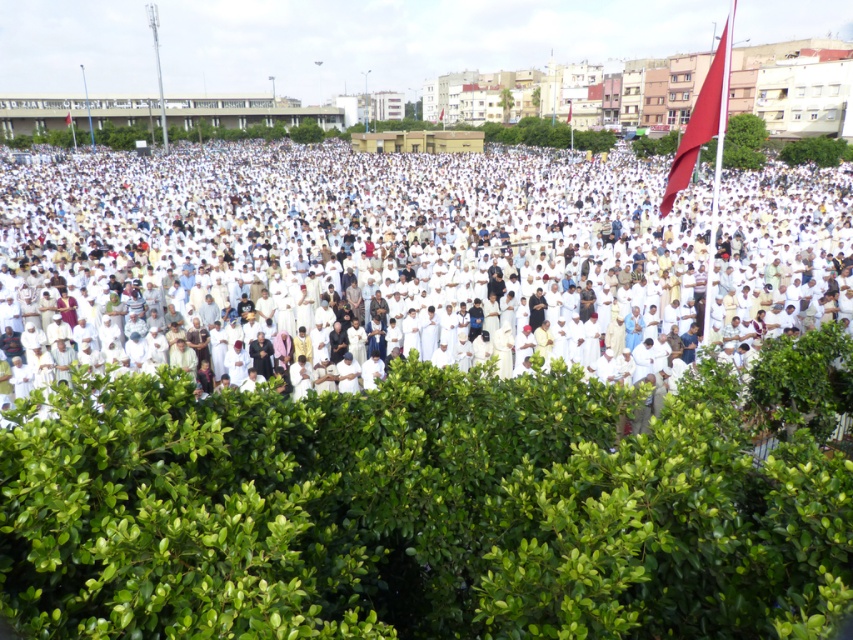
Who is more forward, (x=332, y=168) or (x=677, y=150)?

Positioned in front is point (x=677, y=150).

Is point (399, 227) farther from viewer compared to point (700, 124)?

Yes, point (399, 227) is behind point (700, 124).

Who is more distant from viewer, (227,256) or (730,22)?

Positioned behind is point (227,256).

Identify the location of white matte clothing at center. (413, 248).